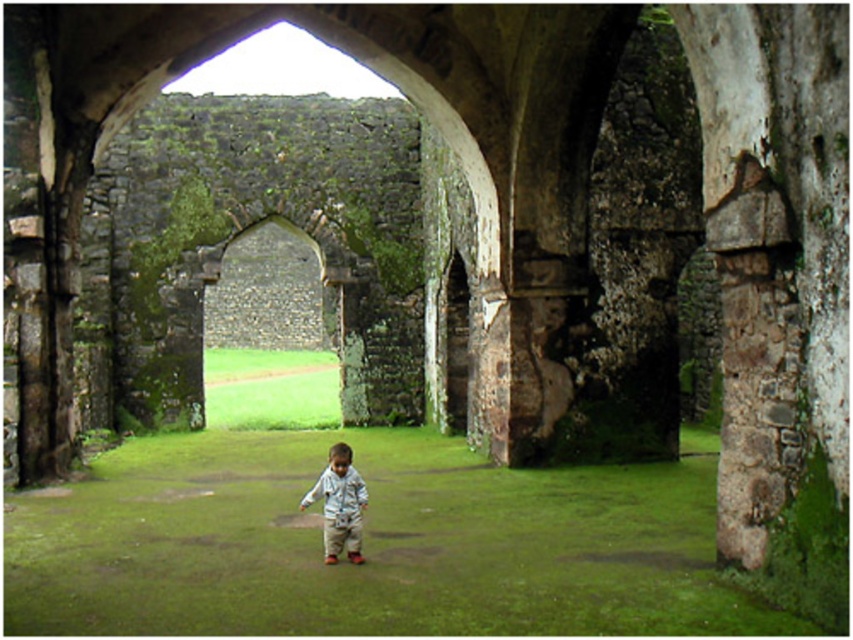
You are a tourist visiting the ancient stone structure. You see the green grass at center and the light blue fabric boy at center. Which object is closer to the ground?

The green grass at center is closer to the ground as it is positioned below the light blue fabric boy at center.

Looking at this image, you are a photographer trying to capture the light blue fabric boy at center and the green grass at center in a single shot. Which object should you focus on first if you want both to be in sharp focus?

You should focus on the light blue fabric boy at center first because it is smaller than the green grass at center, ensuring that the smaller object is in focus while the larger one may still be within the depth of field.